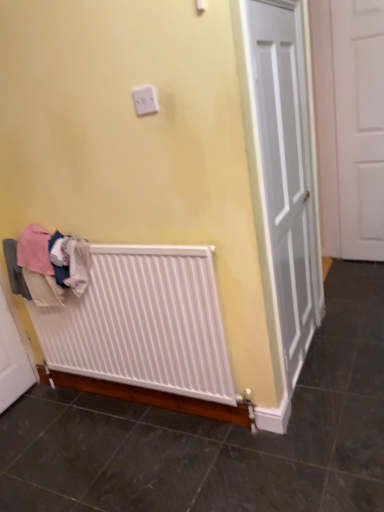
Question: Does white matte radiator at lower left have a greater height compared to white matte door at right?

Choices:
 (A) yes
 (B) no

Answer: (B)

Question: Is white matte radiator at lower left far from white matte door at right?

Choices:
 (A) yes
 (B) no

Answer: (A)

Question: Is white matte radiator at lower left thinner than white matte door at right?

Choices:
 (A) yes
 (B) no

Answer: (A)

Question: Is white matte radiator at lower left looking in the opposite direction of white matte door at right?

Choices:
 (A) no
 (B) yes

Answer: (B)

Question: From a real-world perspective, is white matte radiator at lower left physically below white matte door at right?

Choices:
 (A) no
 (B) yes

Answer: (B)

Question: Is point (140, 101) positioned closer to the camera than point (56, 270)?

Choices:
 (A) closer
 (B) farther

Answer: (A)

Question: Based on their sizes in the image, would you say white plastic outlet at upper center is bigger or smaller than white cotton clothes at lower left?

Choices:
 (A) big
 (B) small

Answer: (B)

Question: Visually, is white plastic outlet at upper center positioned to the left or to the right of white cotton clothes at lower left?

Choices:
 (A) right
 (B) left

Answer: (A)

Question: Would you say white plastic outlet at upper center is inside or outside white cotton clothes at lower left?

Choices:
 (A) inside
 (B) outside

Answer: (B)

Question: From a real-world perspective, is white cotton clothes at lower left above or below white matte radiator at lower left?

Choices:
 (A) below
 (B) above

Answer: (B)

Question: Is white cotton clothes at lower left wider or thinner than white matte radiator at lower left?

Choices:
 (A) wide
 (B) thin

Answer: (B)

Question: Considering their positions, is white cotton clothes at lower left located in front of or behind white matte radiator at lower left?

Choices:
 (A) behind
 (B) front

Answer: (A)

Question: Is white cotton clothes at lower left bigger or smaller than white matte radiator at lower left?

Choices:
 (A) big
 (B) small

Answer: (B)

Question: Based on their positions, is white plastic outlet at upper center located to the left or right of white matte radiator at lower left?

Choices:
 (A) left
 (B) right

Answer: (B)

Question: In the image, is white plastic outlet at upper center positioned in front of or behind white matte radiator at lower left?

Choices:
 (A) front
 (B) behind

Answer: (A)